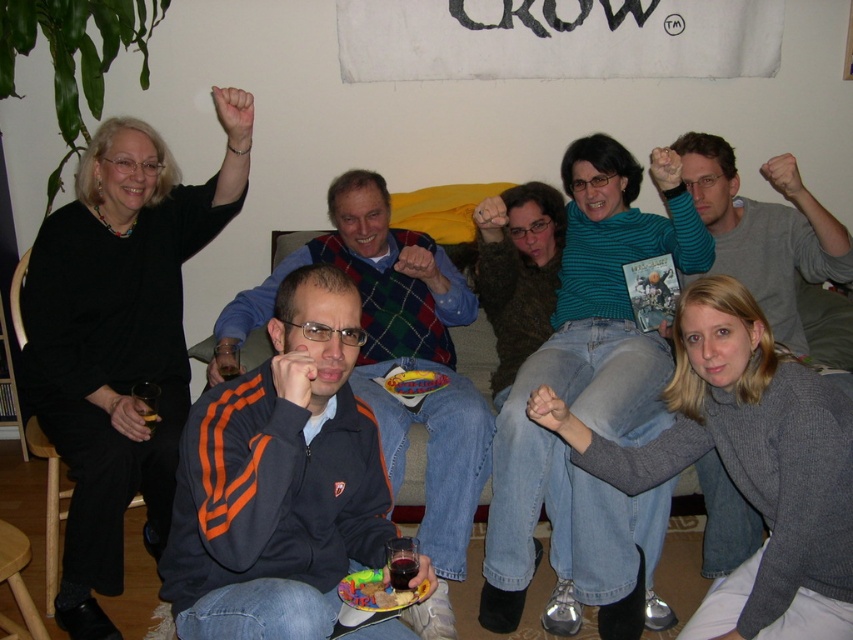
Question: Which point appears closest to the camera in this image?

Choices:
 (A) (700, 176)
 (B) (714, 621)
 (C) (169, 499)
 (D) (479, 397)

Answer: (B)

Question: Does knitted gray sweater at lower right appear over gray sweater at center?

Choices:
 (A) no
 (B) yes

Answer: (A)

Question: Which of the following is the farthest from the observer?

Choices:
 (A) orange-striped jacket at center
 (B) knitted gray sweater at lower right

Answer: (A)

Question: Is black matte sweater at upper left below gray sweater at center?

Choices:
 (A) no
 (B) yes

Answer: (B)

Question: Can you confirm if black matte sweater at upper left is positioned below knitted gray sweater at lower right?

Choices:
 (A) yes
 (B) no

Answer: (B)

Question: Which object is the farthest from the black matte sweater at upper left?

Choices:
 (A) knitted gray sweater at lower right
 (B) gray sweater at center

Answer: (B)